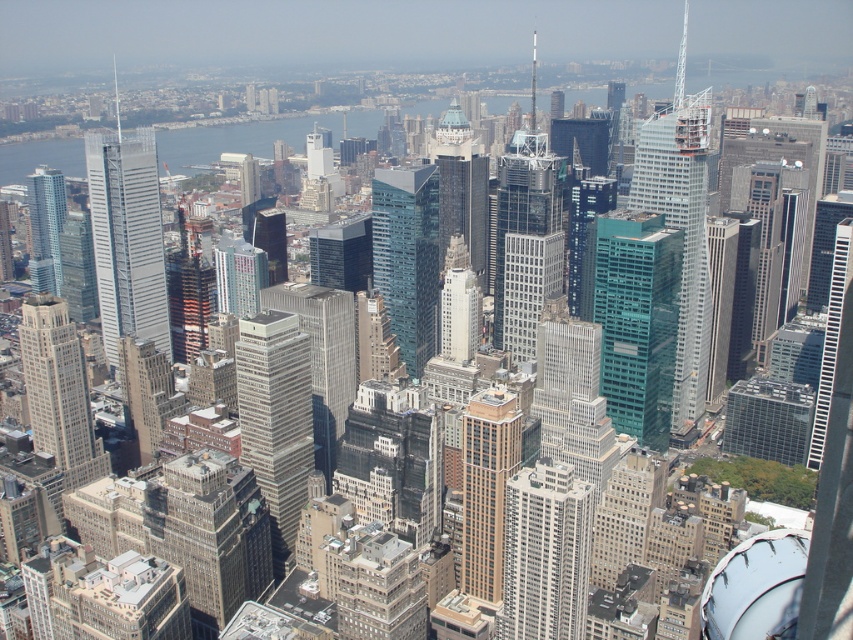
Question: Is green glass skyscraper at center-right positioned at the back of glassy steel skyscraper at center?

Choices:
 (A) yes
 (B) no

Answer: (A)

Question: Is gray glass skyscraper at center behind brown brick building at center?

Choices:
 (A) yes
 (B) no

Answer: (A)

Question: Based on their relative distances, which object is nearer to the green glass skyscraper at center?

Choices:
 (A) glassy silver skyscraper at left
 (B) white glass building at center

Answer: (B)

Question: Estimate the real-world distances between objects in this image. Which object is closer to the glassy silver skyscraper at left?

Choices:
 (A) transparent glass skyscraper at center
 (B) green glass skyscraper at center-right

Answer: (A)

Question: Is brown brick building at center above shiny glass skyscraper at left?

Choices:
 (A) yes
 (B) no

Answer: (B)

Question: Which object is farther from the camera taking this photo?

Choices:
 (A) shiny glass skyscraper at left
 (B) glassy silver skyscraper at left

Answer: (A)